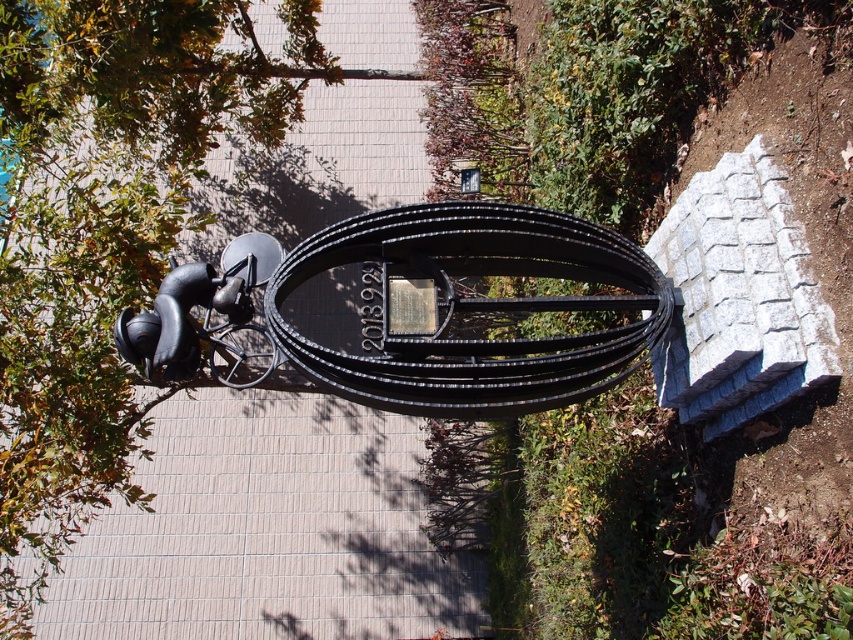
You are a photographer trying to capture the sculpture and both objects mentioned in the scene. Since the green leafy tree at upper left and the black metallic cable at center are in your shot, which one will appear larger in your photo?

The green leafy tree at upper left will appear larger in the photo because it is taller than the black metallic cable at center.

You are standing on the paved pathway in front of the sculpture. You want to take a photo of the black metallic cable at center without the green leafy tree at upper left blocking the view. Which direction should you move to achieve this?

Move closer to the sculpture. Since the green leafy tree at upper left is closer to you than the black metallic cable at center, moving forward will reduce the tree blocking the cable in your photo.